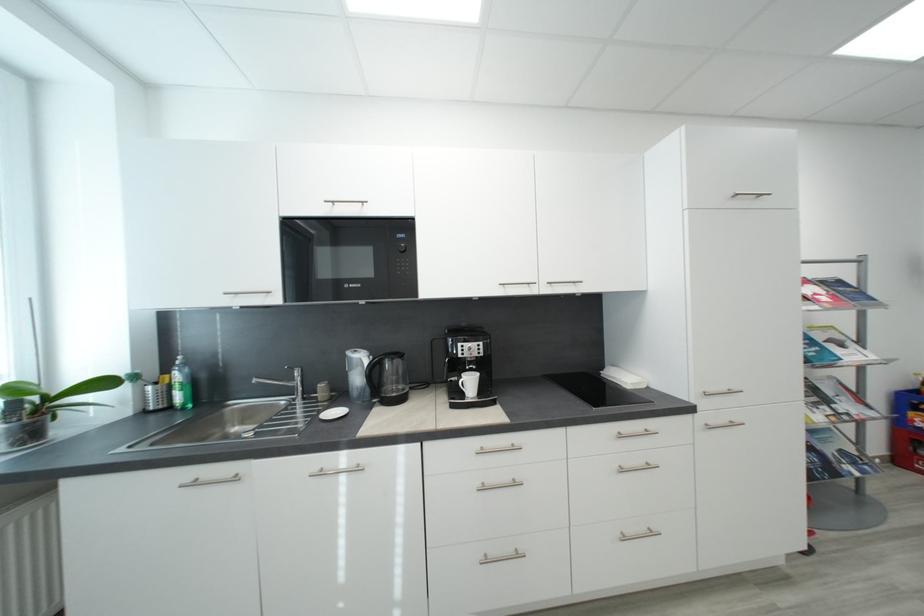
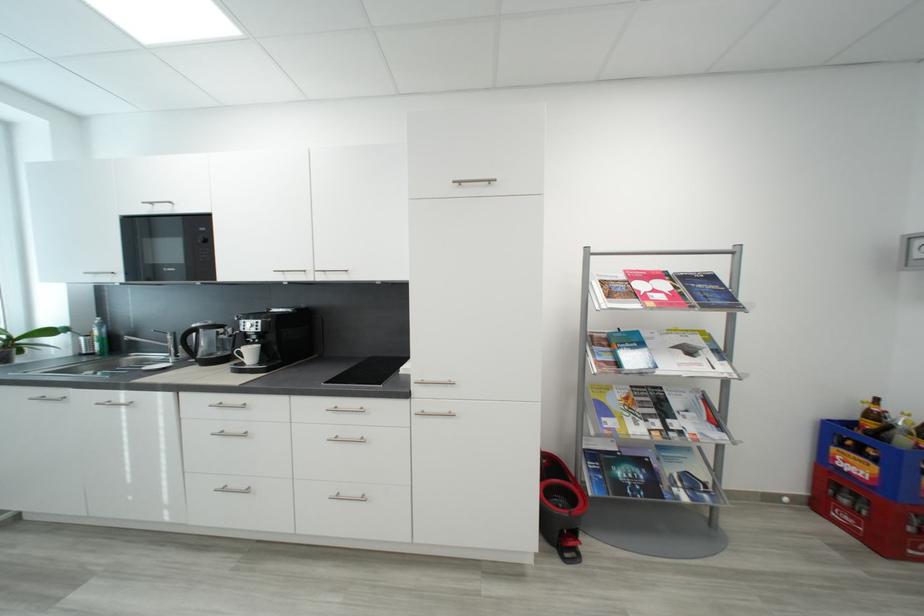
In the second image, find the point that corresponds to point 246,407 in the first image.

(142, 358)